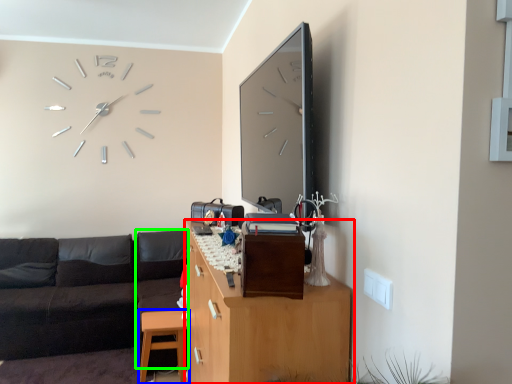
Question: Considering the real-world distances, which object is farthest from cabinetry (highlighted by a red box)? table (highlighted by a blue box) or couch (highlighted by a green box)?

Choices:
 (A) table
 (B) couch

Answer: (B)